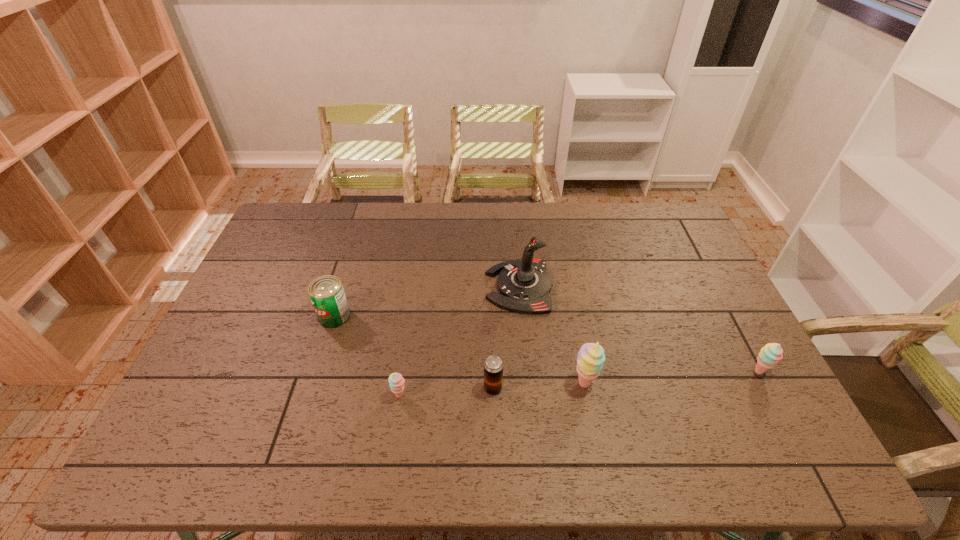
Identify the location of free point that satisfies the following two spatial constraints: 1. on the front side of the tallest sherbert; 2. on the left side of the leftmost object. (314, 383).

Find the location of a particular element. free space in the image that satisfies the following two spatial constraints: 1. on the handle side of the joystick; 2. on the right side of the second tallest sherbert is located at coordinates (527, 372).

What are the coordinates of `vacant space that satisfies the following two spatial constraints: 1. on the back side of the tallest sherbert; 2. on the handle side of the joystick` in the screenshot? It's located at [x=564, y=287].